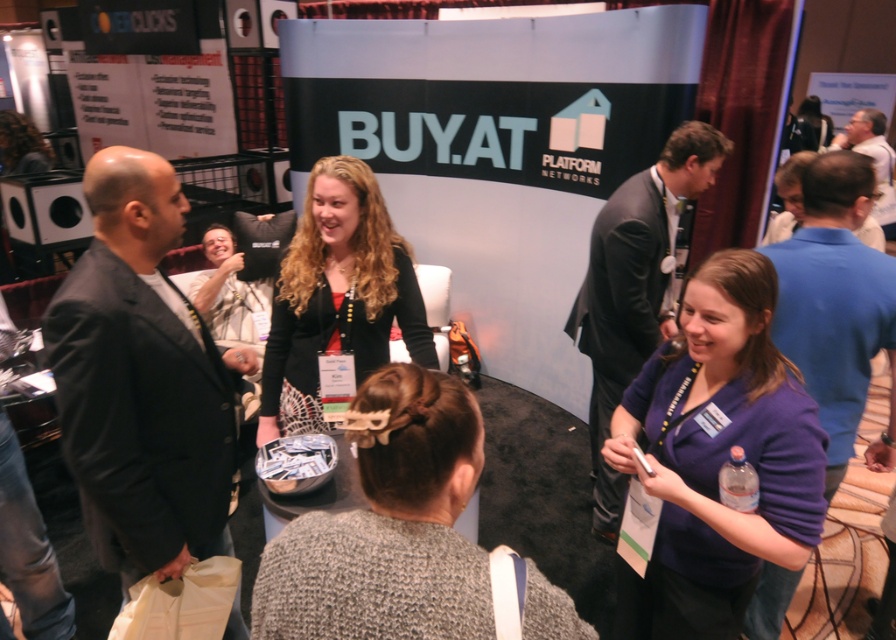
You are a photographer at the event and want to capture a photo that includes both the purple fabric shirt at lower right and the black matte blazer at center. Based on their positions, which one should you focus on first to ensure both are in the frame?

The purple fabric shirt at lower right is positioned under the black matte blazer at center, so you should focus on the black matte blazer at center first to ensure both are in the frame.

You are standing at the conference booth and want to move from point A to point B. Point A is at coordinates point (386, 605) and point B is at coordinates point (853, 122). Which direction should you move to go from point A to point B?

To move from point A at coordinates point (386, 605) to point B at coordinates point (853, 122), you should move towards the upper left direction since point B is located in that direction relative to point A.